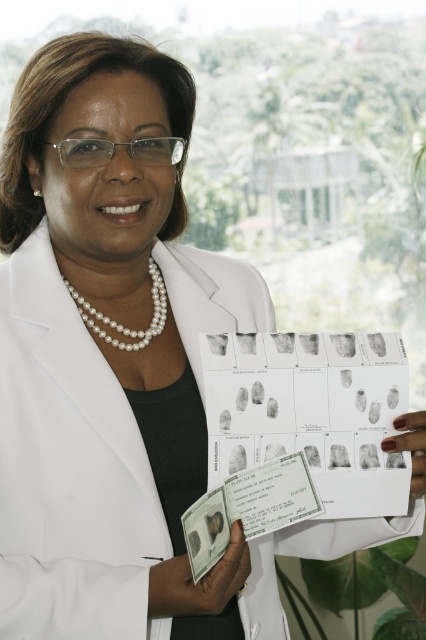
You are a photographer standing 40 inches away from the woman in the image. You want to focus your camera on the point at coordinates point (x=204, y=595). Will your current distance allow you to focus on that point without moving closer?

The distance of point (x=204, y=595) from viewer is 35.84 inches. Since you are standing 40 inches away, which is farther than the point, you can focus on it without moving closer as the camera can adjust focus within that range.

You are a forensic analyst examining the image. You need to determine if the distance between the white paper at center and the nail polish painted fingernails at center is sufficient to capture fingerprints clearly. Given that the minimum required distance for clear fingerprint capture is 12 inches, can you confirm if the current distance allows for clear fingerprint identification?

The white paper at center and nail polish painted fingernails at center are 11.46 inches apart, which is less than the required 12 inches. Therefore, the current distance may not allow for clear fingerprint identification.

You are an artist trying to sketch the scene. You notice the pearl necklace at center and the nail polish painted fingernails at center. Which object should you draw first if you want to focus on the larger one?

The pearl necklace at center might be wider than the nail polish painted fingernails at center, so you should draw the pearl necklace at center first.